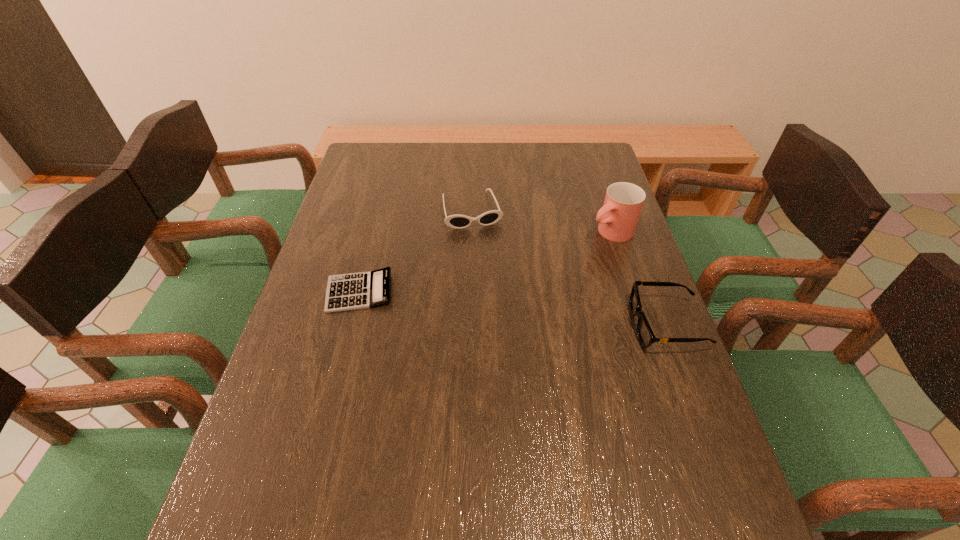
The height and width of the screenshot is (540, 960). What are the coordinates of `vacant space that satisfies the following two spatial constraints: 1. on the front side of the tallest object; 2. on the front-facing side of the right sunglasses` in the screenshot? It's located at (640, 325).